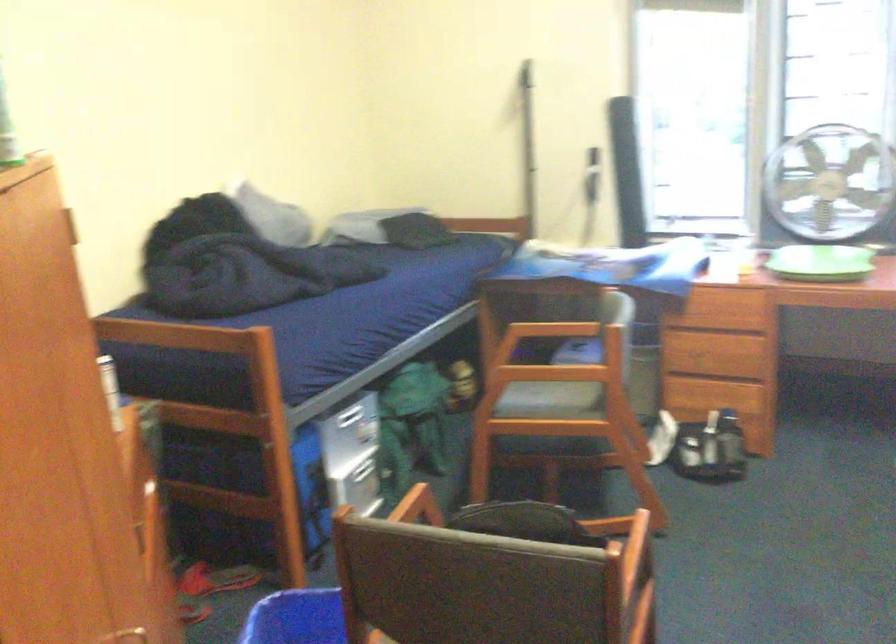
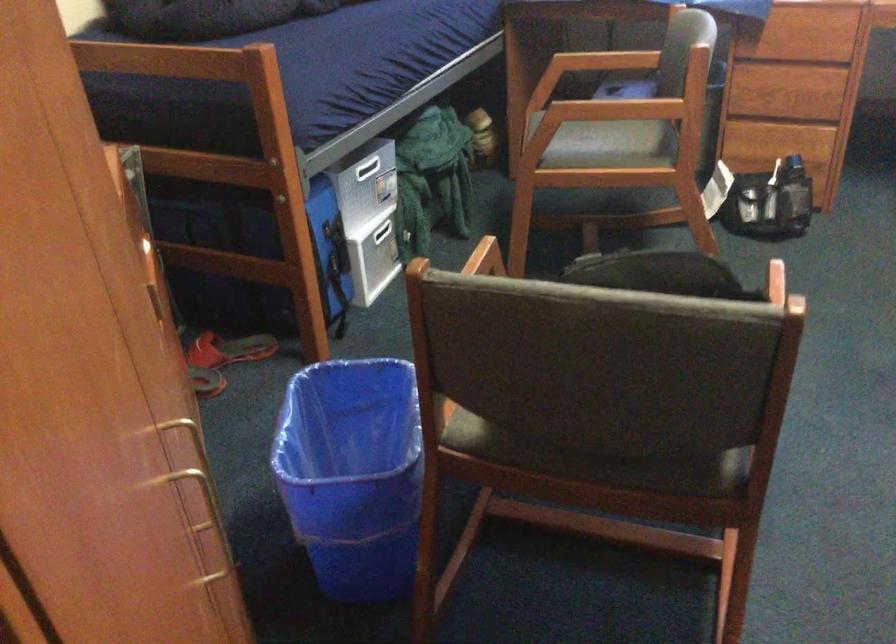
Question: Based on the continuous images, in which direction is the camera rotating? Reply with the corresponding letter.

Choices:
 (A) Left
 (B) Right
 (C) Up
 (D) Down

Answer: (D)